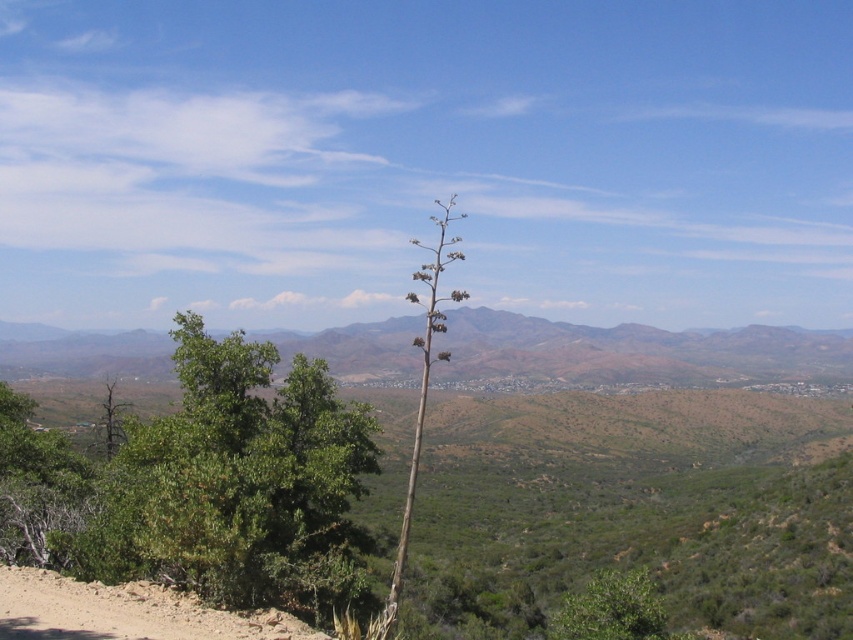
Question: Considering the real-world distances, which object is closest to the brown/dry grassland at center?

Choices:
 (A) green woody at center
 (B) green leafy tree at lower right

Answer: (A)

Question: In this image, where is green leafy tree at left located relative to green leafy tree at lower right?

Choices:
 (A) right
 (B) left

Answer: (B)

Question: Can you confirm if brown/dry grassland at center is positioned to the left of green leafy tree at lower right?

Choices:
 (A) yes
 (B) no

Answer: (A)

Question: Among these points, which one is farthest from the camera?

Choices:
 (A) (439, 356)
 (B) (202, 353)
 (C) (582, 621)
 (D) (457, 340)

Answer: (D)

Question: Estimate the real-world distances between objects in this image. Which object is farther from the green leafy tree at left?

Choices:
 (A) green leafy tree at lower right
 (B) brown/dry grassland at center
 (C) green woody at center

Answer: (B)

Question: Is green leafy tree at left to the left of green leafy tree at lower right from the viewer's perspective?

Choices:
 (A) no
 (B) yes

Answer: (B)